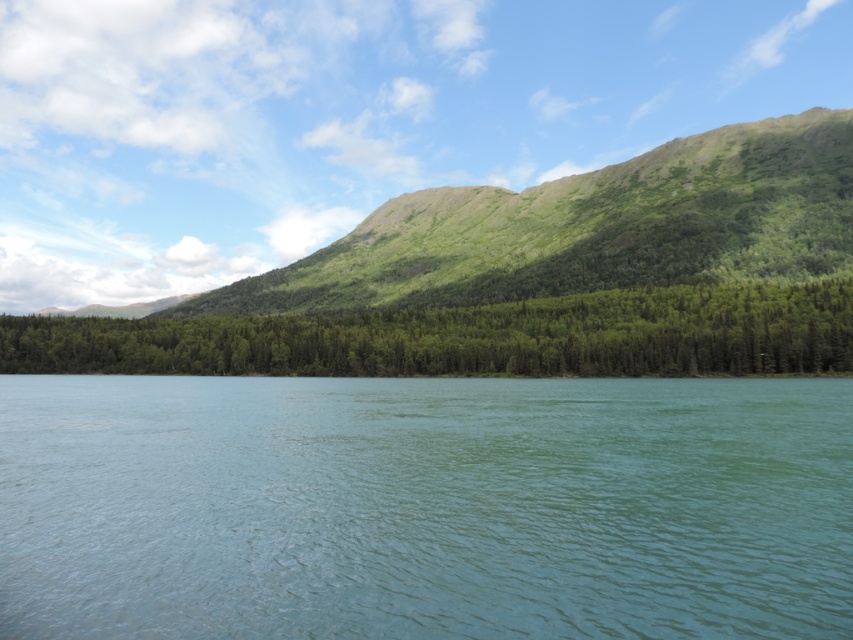
Between green smooth water at center and green matte forest at center, which one has less height?

With less height is green smooth water at center.

Which is behind, point (512, 548) or point (387, 333)?

The point (387, 333) is behind.

What do you see at coordinates (424, 506) in the screenshot? I see `green smooth water at center` at bounding box center [424, 506].

Find the location of a particular element. green smooth water at center is located at coordinates (424, 506).